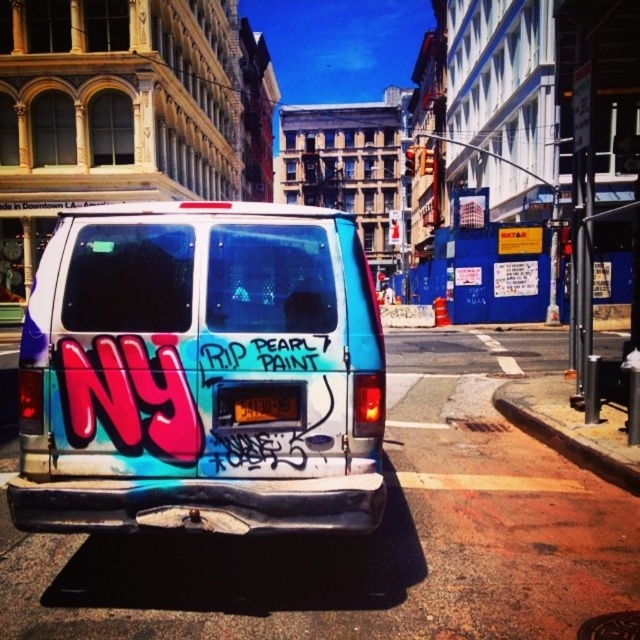
You are standing on the sidewalk and see two points marked on the van. The first point is at coordinates point (259,365) and the second is at point (292,417). Which point is closer to you?

Point (259,365) is in front of point (292,417), so it is closer to you.

You are a pedestrian standing on the sidewalk. You see the matte graffiti van at center and the brown concrete curb at lower right. Which object is closer to your right side?

The brown concrete curb at lower right is closer to your right side because it is positioned to the right of the matte graffiti van at center.